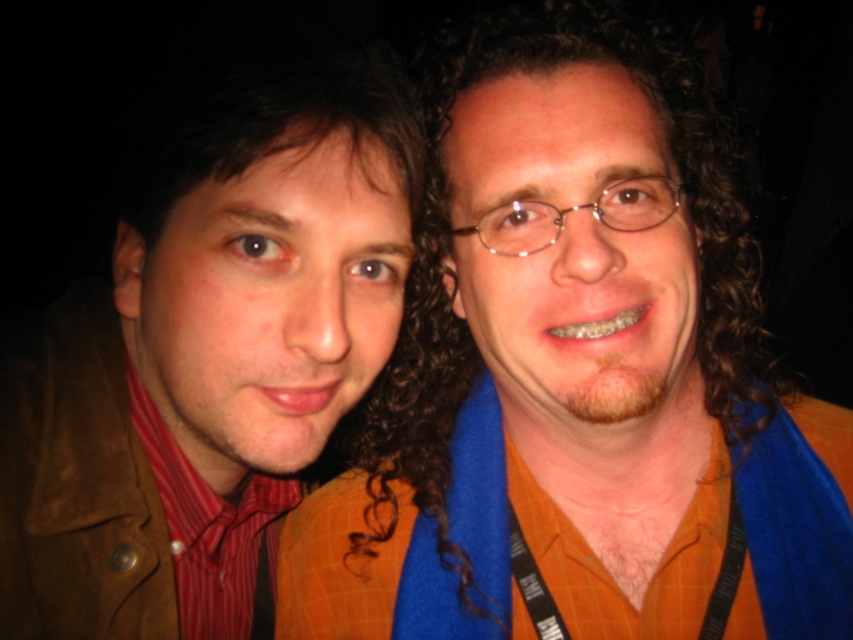
Consider the image. Can you confirm if orange checkered shirt at center is smaller than matte brown jacket at left?

Actually, orange checkered shirt at center might be larger than matte brown jacket at left.

Does orange checkered shirt at center appear on the right side of matte brown jacket at left?

Indeed, orange checkered shirt at center is positioned on the right side of matte brown jacket at left.

Is point (527, 100) positioned before point (224, 564)?

That is True.

I want to click on orange checkered shirt at center, so click(579, 372).

Between orange checkered shirt at center and red striped shirt at left, which one is positioned higher?

orange checkered shirt at center is above.

Is orange checkered shirt at center further to the viewer compared to red striped shirt at left?

No, orange checkered shirt at center is closer to the viewer.

In order to click on orange checkered shirt at center in this screenshot , I will do `click(579, 372)`.

Who is higher up, matte brown jacket at left or red striped shirt at left?

matte brown jacket at left is higher up.

Measure the distance from matte brown jacket at left to red striped shirt at left.

A distance of 3.39 inches exists between matte brown jacket at left and red striped shirt at left.

Who is more forward, (x=155, y=195) or (x=254, y=632)?

Positioned in front is point (x=155, y=195).

You are a GUI agent. You are given a task and a screenshot of the screen. Output one action in this format:
    pyautogui.click(x=<x>, y=<y>)
    Task: Click on the matte brown jacket at left
    This screenshot has width=853, height=640.
    Given the screenshot: What is the action you would take?
    pyautogui.click(x=207, y=358)